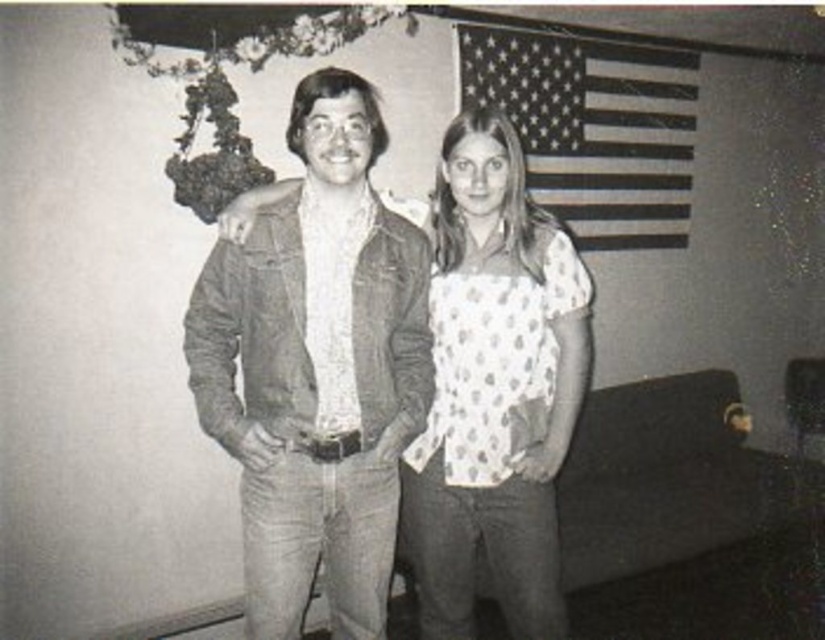
Question: Is denim jacket at center below white dotted blouse at center?

Choices:
 (A) no
 (B) yes

Answer: (A)

Question: Does denim jacket at center lie in front of white dotted blouse at center?

Choices:
 (A) no
 (B) yes

Answer: (B)

Question: Does denim jacket at center appear under white dotted blouse at center?

Choices:
 (A) yes
 (B) no

Answer: (B)